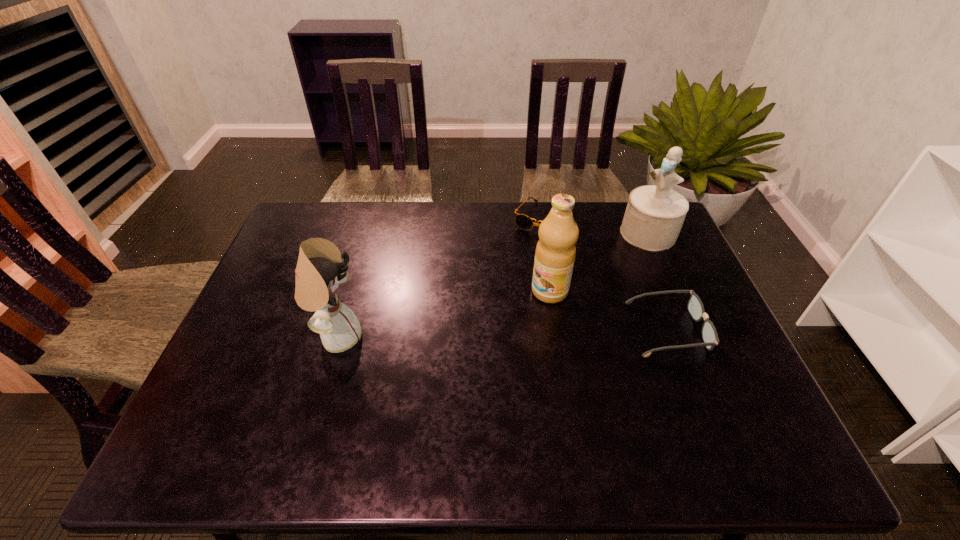
Find the location of a particular element. The width and height of the screenshot is (960, 540). free space between the olive oil and the spectacles is located at coordinates (609, 310).

You are a GUI agent. You are given a task and a screenshot of the screen. Output one action in this format:
    pyautogui.click(x=<x>, y=<y>)
    Task: Click on the free point between the figurine and the sunglasses
    
    Given the screenshot: What is the action you would take?
    pyautogui.click(x=595, y=226)

Identify the location of free space between the sunglasses and the spectacles. Image resolution: width=960 pixels, height=540 pixels. point(605,274).

Locate an element on the screen. The width and height of the screenshot is (960, 540). vacant point located between the olive oil and the spectacles is located at coordinates (609, 310).

Where is `object that ranks as the fourth closest to the figurine`? This screenshot has width=960, height=540. object that ranks as the fourth closest to the figurine is located at coordinates (319, 270).

I want to click on object that is the closest to the figurine, so click(x=524, y=222).

Identify the location of vacant space that satisfies the following two spatial constraints: 1. on the front side of the olive oil; 2. on the face of the spectacles. (556, 329).